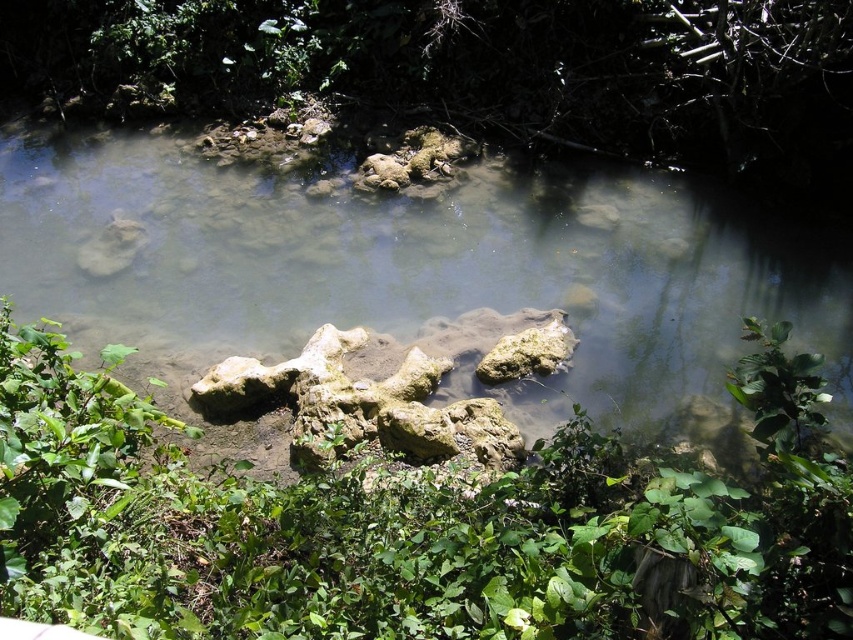
You are standing at the edge of the water in the serene natural scene. There is a point marked at coordinates [409,518]. What can you see at that point?

At point [409,518] lies green leafy vegetation at center.

You are standing at the edge of the water in the scene and want to walk to a point that is behind both point [496,588] and point [299,193]. Is there a location where you can stand that is behind both points?

Yes, since point [496,588] is in front of point [299,193], you can stand behind point [299,193] to be behind both points.

You are standing at the edge of the water and want to reach the green leafy vegetation at center. Based on the coordinates provided, in which direction should you move to get there?

The green leafy vegetation at center is located at coordinates point (409,518), so you should move towards the center of the image to reach it.